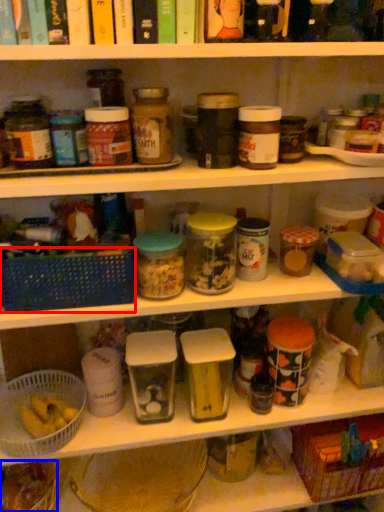
Question: Which of the following is the farthest to the observer, basket (highlighted by a red box) or food (highlighted by a blue box)?

Choices:
 (A) basket
 (B) food

Answer: (B)